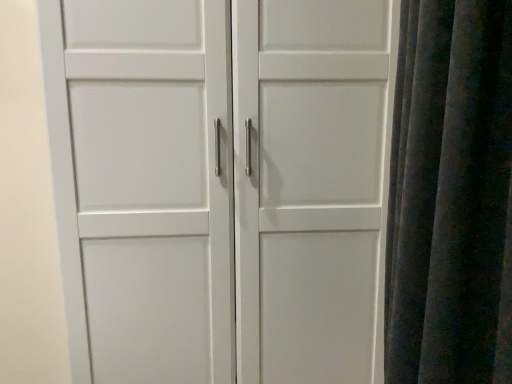
Locate an element on the screen. velvet dark gray shower curtain at right is located at coordinates (451, 196).

This screenshot has width=512, height=384. What do you see at coordinates (451, 196) in the screenshot?
I see `velvet dark gray shower curtain at right` at bounding box center [451, 196].

Find the location of a particular element. This screenshot has width=512, height=384. velvet dark gray shower curtain at right is located at coordinates (451, 196).